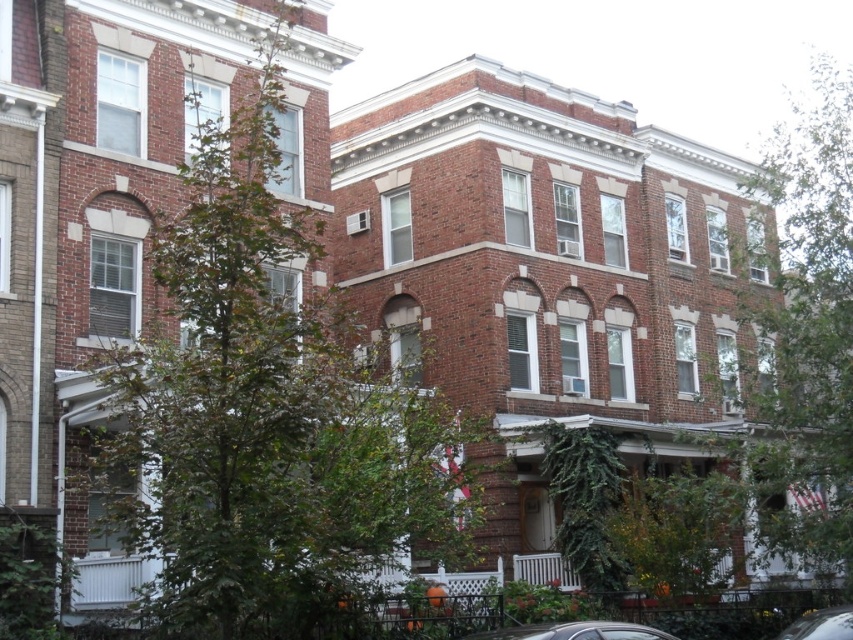
You are standing in front of the row of brick townhouses and want to locate the green leafy tree at right. Based on the coordinates provided, where should you look relative to the townhouses?

The green leafy tree at right is located at coordinates point (x=802, y=330), which means it is positioned slightly to the right and near the bottom of the image relative to the townhouses.

Based on the photo, you are a delivery driver trying to park your metallic silver car at center in a narrow alley between two brick townhouses. There is another metallic silver car at lower right already parked. Based on the scene, can you determine if there is enough space to park your car without blocking the other car?

The metallic silver car at center is in front of the metallic silver car at lower right, meaning it is closer to the viewer. This suggests that there is space between them for parking, so you can park your metallic silver car at center without blocking the other car as long as you position it in front without overlapping.

You are a delivery driver approaching the metallic silver car at center parked in front of the row of brick townhouses. There is a green leafy tree at right nearby. From your perspective, is the tree positioned higher or lower than the car?

The green leafy tree at right is above the metallic silver car at center, so the tree is positioned higher than the car.